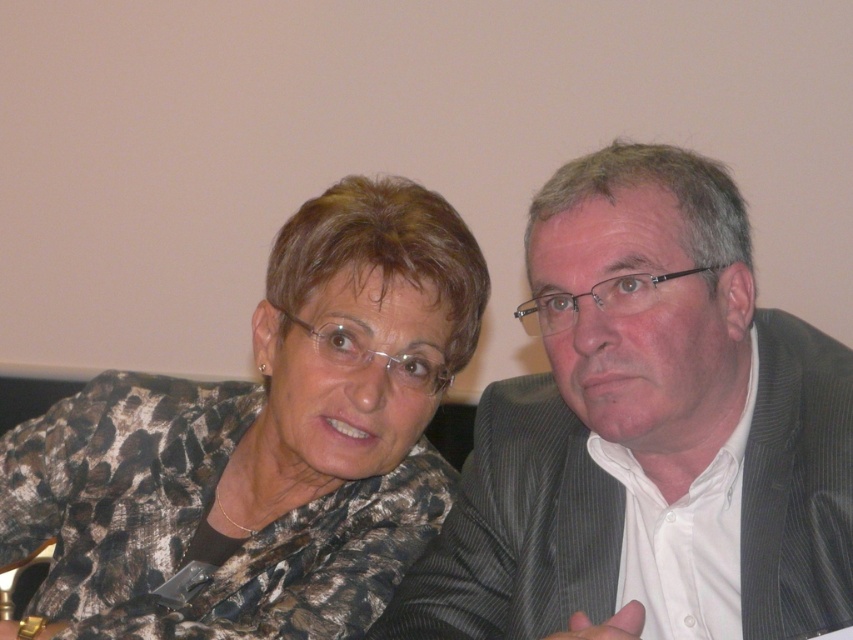
Describe the element at coordinates (647, 435) in the screenshot. I see `gray striped suit at right` at that location.

The height and width of the screenshot is (640, 853). I want to click on gray striped suit at right, so click(647, 435).